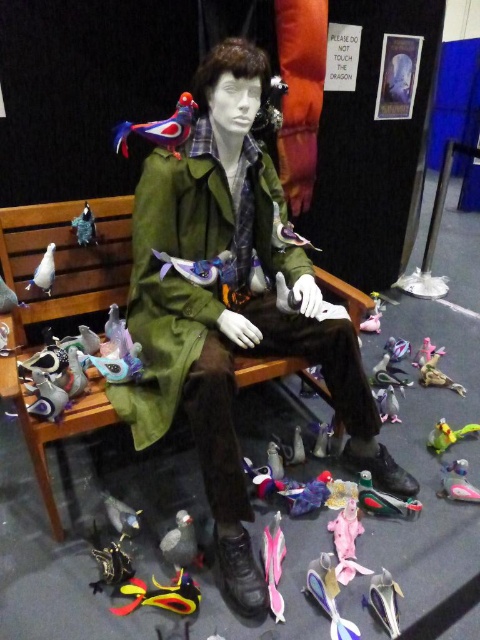
Question: Which object is farther from the camera taking this photo?

Choices:
 (A) matte purple plush toy at lower left
 (B) green matte coat at center

Answer: (A)

Question: Is shiny blue plastic toy at lower center wider than matte gray toy at left?

Choices:
 (A) no
 (B) yes

Answer: (B)

Question: Is wooden bench at center behind shiny blue plastic toy at lower center?

Choices:
 (A) no
 (B) yes

Answer: (A)

Question: Among these points, which one is farthest from the camera?

Choices:
 (A) (124, 141)
 (B) (120, 518)
 (C) (60, 291)
 (D) (355, 541)

Answer: (C)

Question: Estimate the real-world distances between objects in this image. Which object is closer to the pink fabric toy at lower right?

Choices:
 (A) matte purple plush toy at lower left
 (B) green fabric toy at lower right

Answer: (B)

Question: Is rubberized yellow and black toy at lower center positioned in front of matte gray toy at left?

Choices:
 (A) yes
 (B) no

Answer: (A)